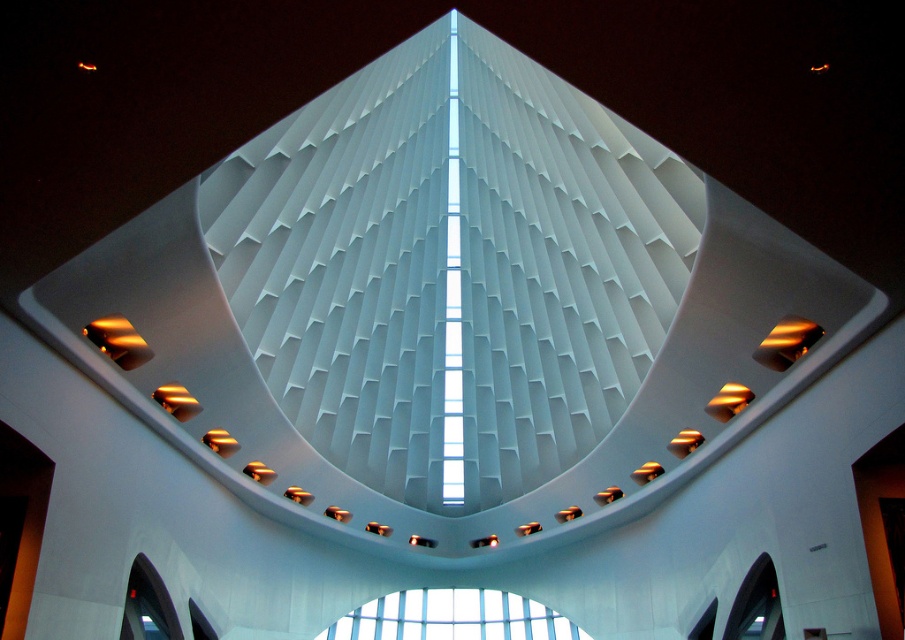
Question: Does clear glass window at center appear under transparent glass window at lower right?

Choices:
 (A) no
 (B) yes

Answer: (B)

Question: Among these points, which one is farthest from the camera?

Choices:
 (A) (458, 596)
 (B) (746, 582)

Answer: (A)

Question: Which object is farther from the camera taking this photo?

Choices:
 (A) transparent glass window at lower right
 (B) clear glass window at center

Answer: (B)

Question: Does clear glass window at center appear on the right side of transparent glass window at lower right?

Choices:
 (A) yes
 (B) no

Answer: (B)

Question: Does clear glass window at center appear over transparent glass window at lower right?

Choices:
 (A) no
 (B) yes

Answer: (A)